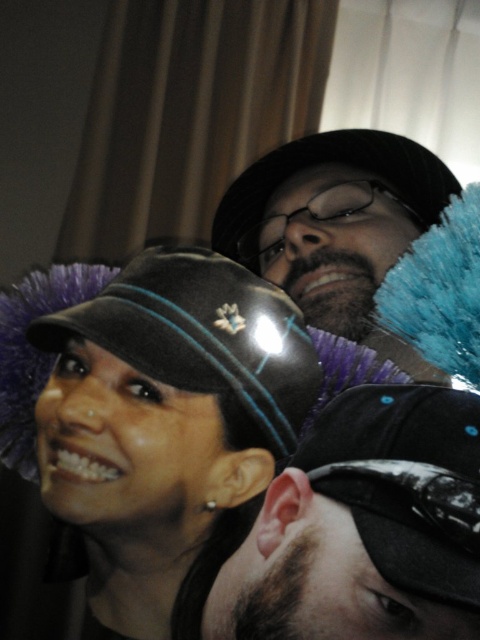
Is matte black cap at center closer to the viewer compared to matte black hat at center?

Yes.

Who is more distant from viewer, (190, 486) or (337, 248)?

Point (337, 248)

I want to click on matte black cap at center, so click(163, 424).

Is black shiny cap at center thinner than matte black hat at center?

Yes, black shiny cap at center is thinner than matte black hat at center.

Who is more forward, (269,570) or (298,196)?

Point (269,570)

Does point (252, 611) come closer to viewer compared to point (396, 237)?

Yes, it is in front of point (396, 237).

This screenshot has width=480, height=640. I want to click on black shiny cap at center, so click(x=354, y=531).

Consider the image. Is matte black cap at center to the left of black shiny cap at center from the viewer's perspective?

Indeed, matte black cap at center is positioned on the left side of black shiny cap at center.

Is matte black cap at center above black shiny cap at center?

Indeed, matte black cap at center is positioned over black shiny cap at center.

Is point (249, 292) closer to camera compared to point (261, 550)?

No, (249, 292) is behind (261, 550).

Locate an element on the screen. matte black cap at center is located at coordinates (163, 424).